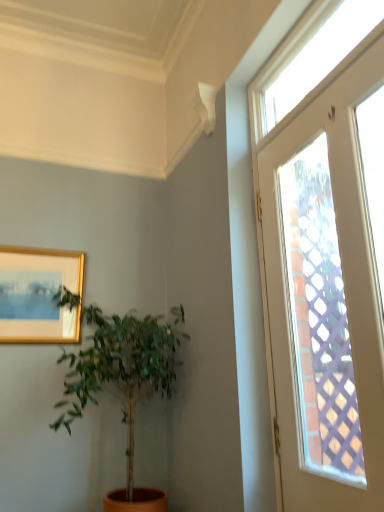
Question: Does green leafy plant at left appear on the right side of clear glass window at upper right, the second window when ordered from bottom to top?

Choices:
 (A) no
 (B) yes

Answer: (A)

Question: Is green leafy plant at left next to clear glass window at upper right, the second window when ordered from bottom to top?

Choices:
 (A) yes
 (B) no

Answer: (B)

Question: Would you say clear glass window at upper right, the second window when ordered from bottom to top, is part of green leafy plant at left's contents?

Choices:
 (A) yes
 (B) no

Answer: (B)

Question: Is green leafy plant at left positioned far away from clear glass window at upper right, the second window when ordered from bottom to top?

Choices:
 (A) no
 (B) yes

Answer: (B)

Question: Is green leafy plant at left closer to camera compared to clear glass window at upper right, which is the first window in top-to-bottom order?

Choices:
 (A) yes
 (B) no

Answer: (B)

Question: Can you confirm if green leafy plant at left is taller than clear glass window at upper right, which is the first window in top-to-bottom order?

Choices:
 (A) yes
 (B) no

Answer: (A)

Question: Is gold-framed picture at upper left turned away from clear glass window at upper right, which is the first window in top-to-bottom order?

Choices:
 (A) yes
 (B) no

Answer: (B)

Question: From the image's perspective, is gold-framed picture at upper left located beneath clear glass window at upper right, which is the first window in top-to-bottom order?

Choices:
 (A) no
 (B) yes

Answer: (B)

Question: From a real-world perspective, is gold-framed picture at upper left positioned under clear glass window at upper right, which is the first window in top-to-bottom order, based on gravity?

Choices:
 (A) no
 (B) yes

Answer: (B)

Question: Can you confirm if gold-framed picture at upper left is thinner than clear glass window at upper right, the second window when ordered from bottom to top?

Choices:
 (A) no
 (B) yes

Answer: (B)

Question: Is gold-framed picture at upper left taller than clear glass window at upper right, the second window when ordered from bottom to top?

Choices:
 (A) yes
 (B) no

Answer: (A)

Question: Is gold-framed picture at upper left directly adjacent to clear glass window at upper right, which is the first window in top-to-bottom order?

Choices:
 (A) yes
 (B) no

Answer: (B)

Question: Is green leafy plant at left at the back of clear glass door at upper right, the second window positioned from the top?

Choices:
 (A) no
 (B) yes

Answer: (A)